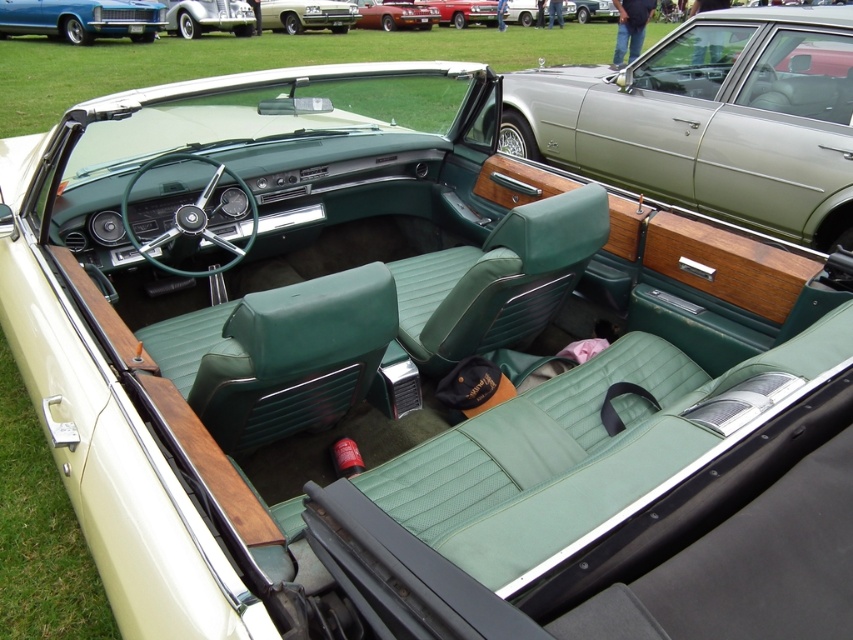
Question: Considering the relative positions of green leather seats at center and shiny red car at center in the image provided, where is green leather seats at center located with respect to shiny red car at center?

Choices:
 (A) right
 (B) left

Answer: (A)

Question: Which of the following is the closest to the observer?

Choices:
 (A) (721, 216)
 (B) (374, 8)

Answer: (A)

Question: Can you confirm if green leather seats at center is positioned below metallic blue car at upper left?

Choices:
 (A) yes
 (B) no

Answer: (A)

Question: Can you confirm if green leather seats at center is positioned to the left of shiny silver car at upper left?

Choices:
 (A) yes
 (B) no

Answer: (B)

Question: Which point is closer to the camera?

Choices:
 (A) (169, 4)
 (B) (276, 4)
 (C) (733, 115)

Answer: (C)

Question: Considering the real-world distances, which object is farthest from the metallic silver sedan at center?

Choices:
 (A) shiny silver car at upper left
 (B) metallic blue car at upper left

Answer: (B)